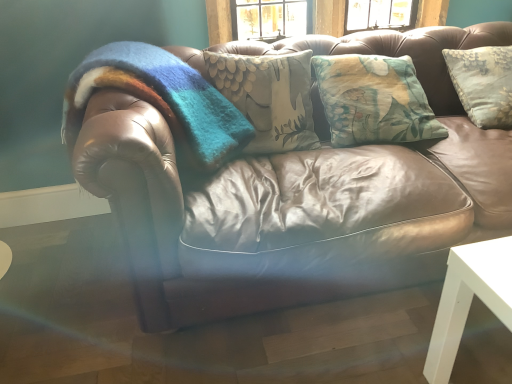
Measure the distance between point (x=289, y=160) and camera.

Point (x=289, y=160) and camera are 1.50 meters apart.

This screenshot has height=384, width=512. I want to click on leather couch at center, so click(x=314, y=240).

Describe the element at coordinates (314, 240) in the screenshot. The image size is (512, 384). I see `leather couch at center` at that location.

Identify the location of leather couch at center. (314, 240).